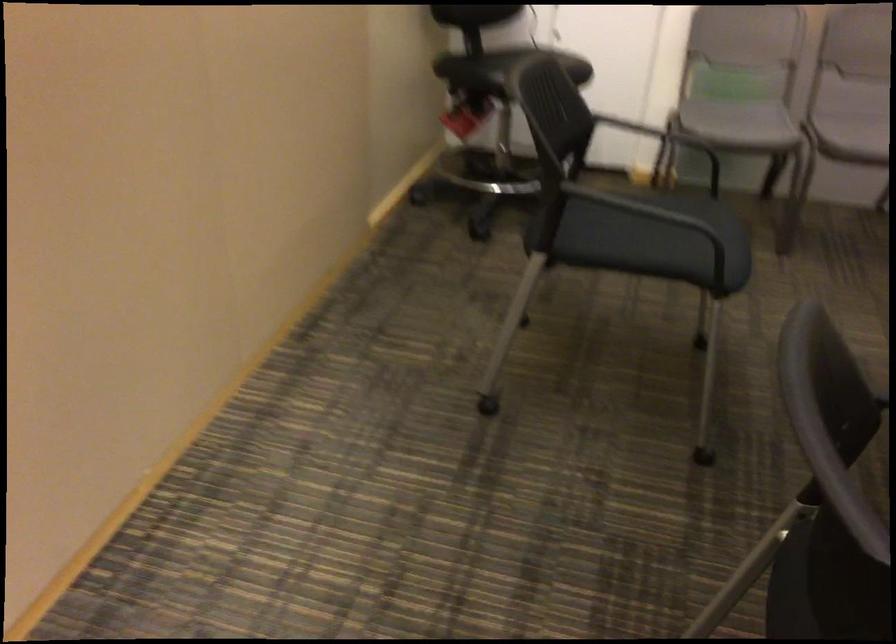
Where is `grey chair armrest`? grey chair armrest is located at coordinates (738, 120).